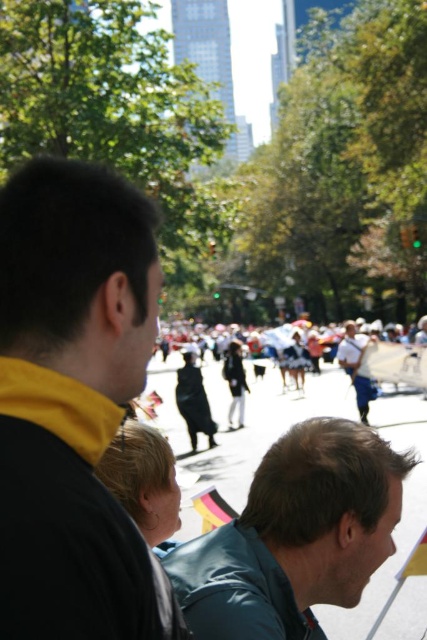
Describe the element at coordinates (73, 404) in the screenshot. I see `black matte jacket at left` at that location.

Does black matte jacket at left lie behind dark blue fabric at center?

No, it is not.

Identify the location of black matte jacket at left. The height and width of the screenshot is (640, 427). point(73,404).

Who is positioned more to the left, smooth gray jacket at lower right or dark blue fabric at center?

Positioned to the left is dark blue fabric at center.

Between point (233, 611) and point (216, 372), which one is positioned behind?

Positioned behind is point (216, 372).

Is point (239, 531) more distant than point (163, 365)?

No, it is not.

I want to click on smooth gray jacket at lower right, so click(x=295, y=536).

Is black matte jacket at left taller than smooth gray jacket at lower right?

Yes, black matte jacket at left is taller than smooth gray jacket at lower right.

Is black matte jacket at left smaller than smooth gray jacket at lower right?

No, black matte jacket at left is not smaller than smooth gray jacket at lower right.

Is point (58, 547) positioned behind point (312, 452)?

No, (58, 547) is in front of (312, 452).

Identify the location of black matte jacket at left. The height and width of the screenshot is (640, 427). (73, 404).